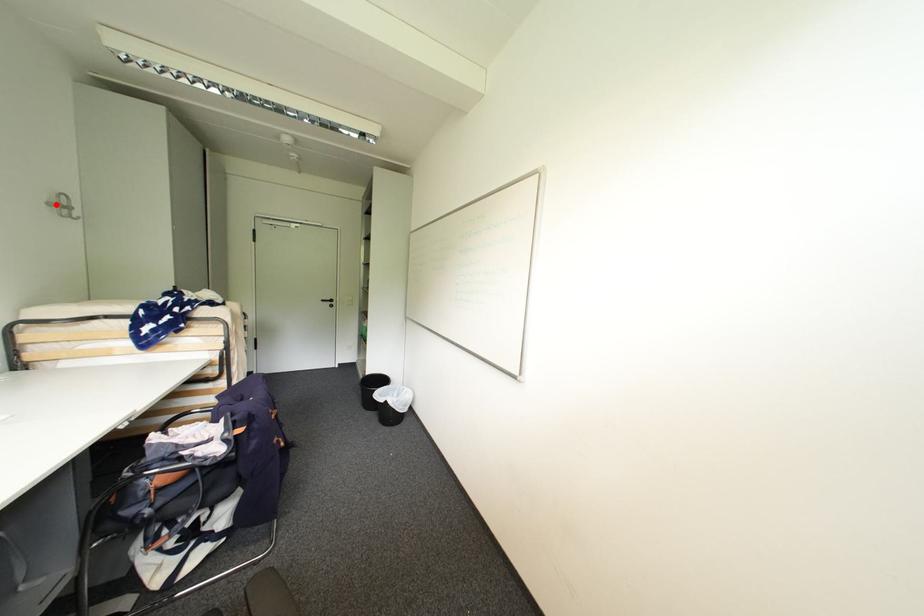
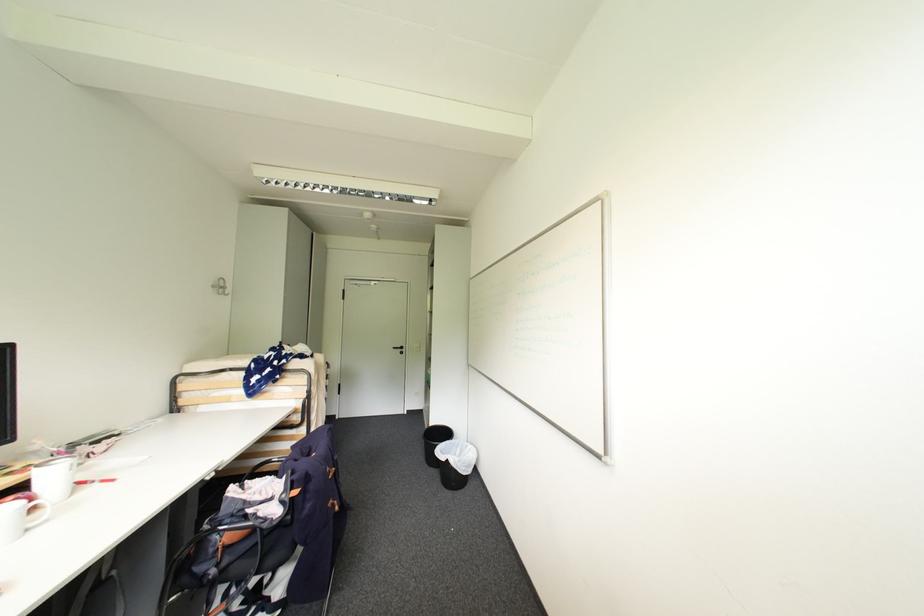
In the second image, find the point that corresponds to the highlighted location in the first image.

(220, 286)